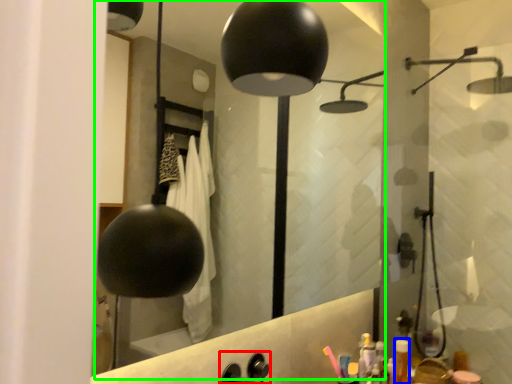
Question: Considering the real-world distances, which object is farthest from faucet (highlighted by a red box)? toiletry (highlighted by a blue box) or mirror (highlighted by a green box)?

Choices:
 (A) toiletry
 (B) mirror

Answer: (B)